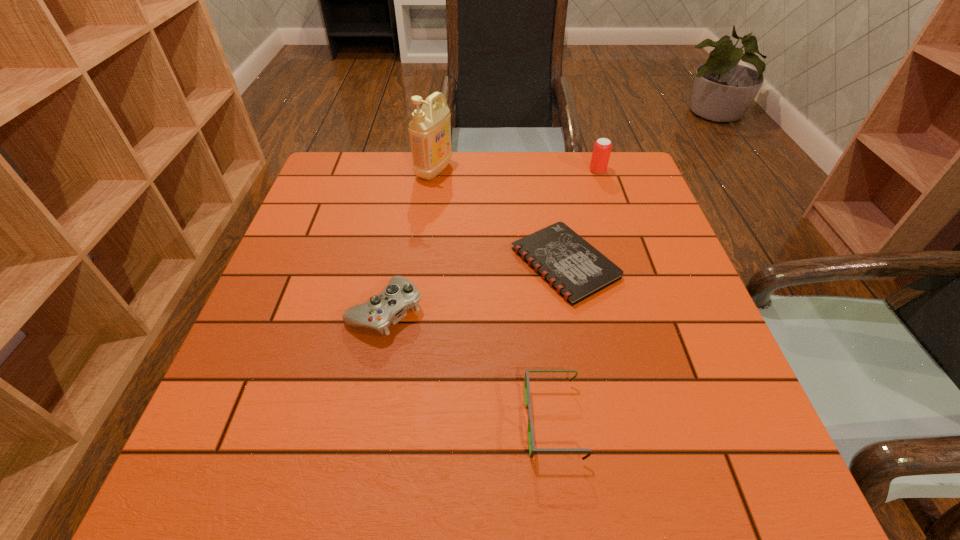
What are the coordinates of `vacant space located on the lens of the second shortest object` in the screenshot? It's located at (480, 421).

The width and height of the screenshot is (960, 540). I want to click on free space located on the lens of the second shortest object, so point(497,421).

This screenshot has width=960, height=540. What are the coordinates of `vacant space located 0.310m on the lens of the second shortest object` in the screenshot? It's located at (346, 421).

Find the location of a particular element. vacant space located on the left of the shortest object is located at coordinates (404, 264).

Locate an element on the screen. The image size is (960, 540). detergent present at the far edge is located at coordinates (430, 130).

Locate an element on the screen. This screenshot has height=540, width=960. beer can that is at the far edge is located at coordinates (602, 148).

At what (x,y) coordinates should I click in order to perform the action: click on object at the near edge. Please return your answer as a coordinate pair (x, y). Looking at the image, I should click on (532, 449).

The width and height of the screenshot is (960, 540). Find the location of `beer can that is positioned at the right edge`. beer can that is positioned at the right edge is located at coordinates (602, 148).

Find the location of a particular element. The image size is (960, 540). notebook at the right edge is located at coordinates (574, 268).

In order to click on object that is at the far right corner in this screenshot , I will do `click(602, 148)`.